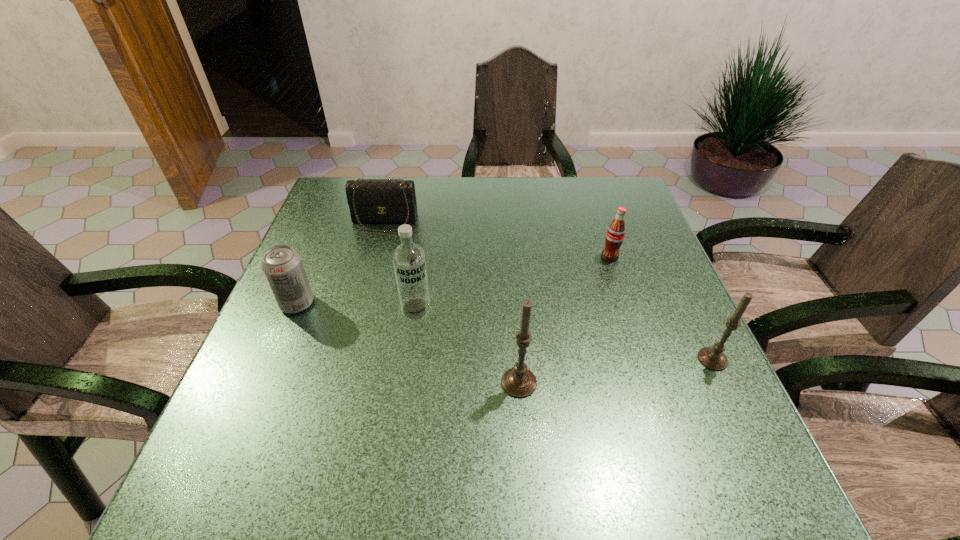
You are a GUI agent. You are given a task and a screenshot of the screen. Output one action in this format:
    pyautogui.click(x=<x>, y=<y>)
    Task: Click on the vacant space that satisfies the following two spatial constraints: 1. on the front label of the third tallest object; 2. on the right side of the vodka
    
    Given the screenshot: What is the action you would take?
    coord(409,359)